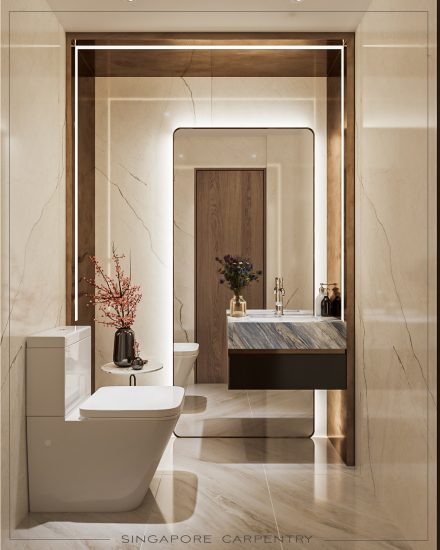
Image resolution: width=440 pixels, height=550 pixels. I want to click on mirror, so click(x=243, y=152).